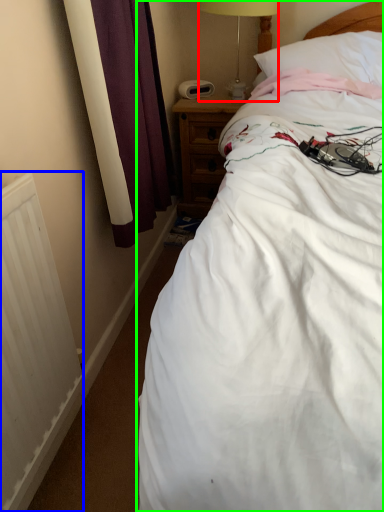
Question: Considering the real-world distances, which object is closest to table lamp (highlighted by a red box)? radiator (highlighted by a blue box) or bed (highlighted by a green box).

Choices:
 (A) radiator
 (B) bed

Answer: (B)